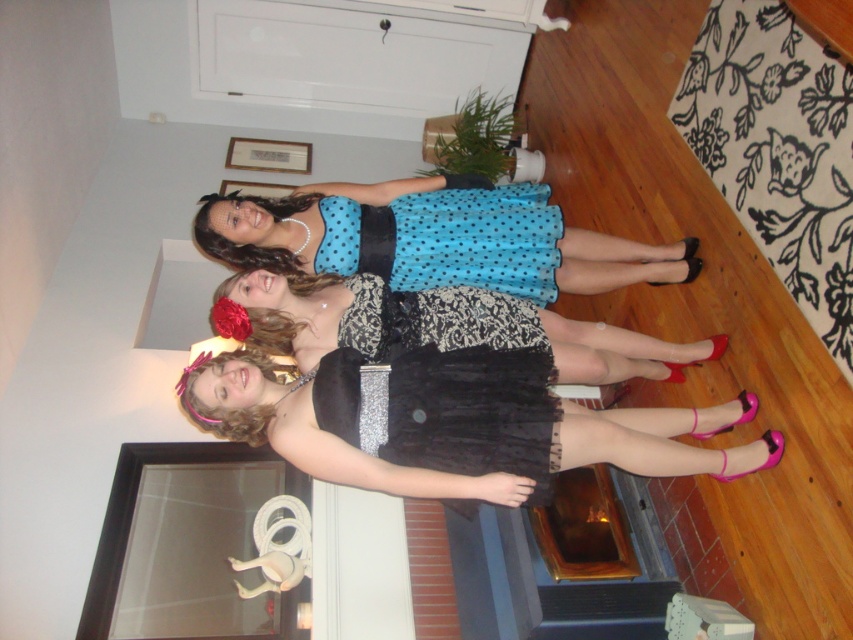
Looking at this image, you are taking a photo of the three individuals in the scene. You want to focus on the point at the bottom of the black lace dress. Which point, point at coordinates (486,408) or point at coordinates (498,209), is closer to the camera and thus should be your focus point?

Point at coordinates (486,408) is closer to the camera than point at coordinates (498,209), so you should focus on point at coordinates (486,408) to ensure the bottom of the black lace dress is in focus.

Based on the photo, you are taking a photo of the black tulle dress at center and the blue polka dot dress at center. Which dress is positioned in front of the other?

The black tulle dress at center is closer to the viewer than the blue polka dot dress at center, so it is positioned in front of the blue polka dot dress at center.

You are a photographer arranging two dresses for a photoshoot. The black tulle dress at center and the blue polka dot tulle dress at center need to be placed side by side. If you want the larger dress to be on the left side, which dress should you place on the left?

The black tulle dress at center has a larger size compared to the blue polka dot tulle dress at center, so you should place the black tulle dress at center on the left side.